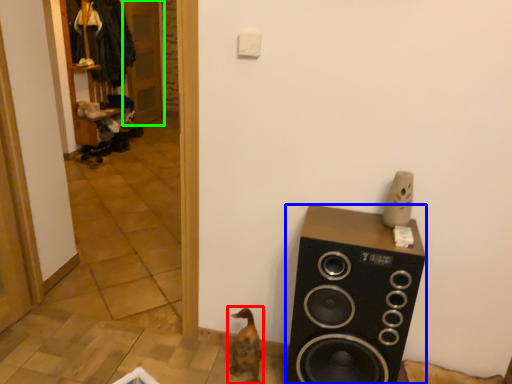
Question: Based on their relative distances, which object is nearer to animal (highlighted by a red box)? Choose from speaker (highlighted by a blue box) and door (highlighted by a green box).

Choices:
 (A) speaker
 (B) door

Answer: (A)